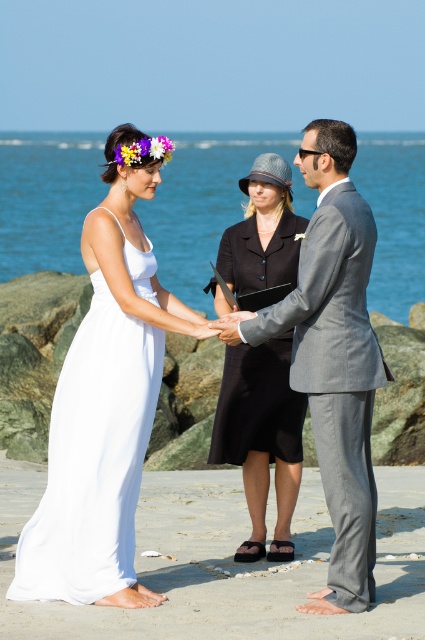
You are a photographer at the wedding and need to capture a photo where both the white silky dress at left and the black matte dress at center are clearly visible. Since the dresses are overlapping, which dress should you adjust to ensure both are fully visible?

The white silky dress at left is positioned over the black matte dress at center. To ensure both are fully visible, you should adjust the white silky dress at left to move it away from the black matte dress at center so there is no overlap.

You are a photographer at the beach wedding. You need to capture a closeup shot of both the white satin dress at center and the gray suit at center in the same frame. The camera you are using has a minimum focusing distance of 16 inches. Can you take the photo without moving either of the subjects?

The white satin dress at center is 15.53 inches from the gray suit at center, which is less than the camera minimum focusing distance of 16 inches. Therefore, you cannot take the photo without moving either of the subjects.